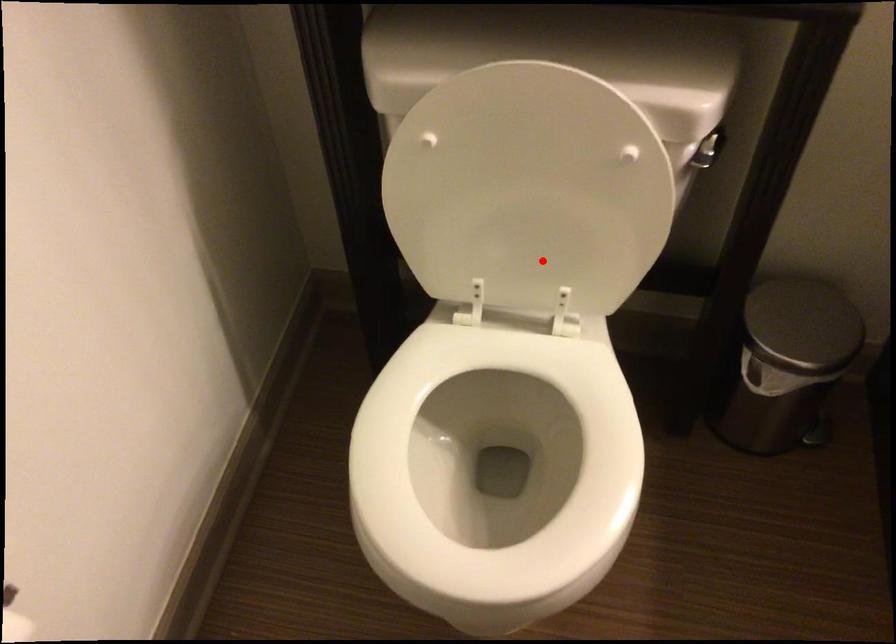
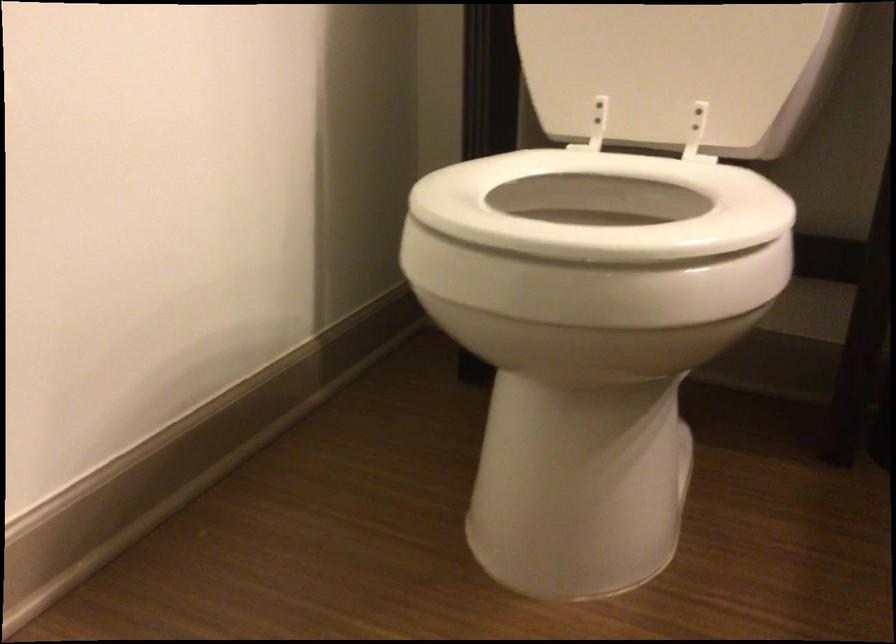
Find the pixel in the second image that matches the highlighted location in the first image.

(677, 71)